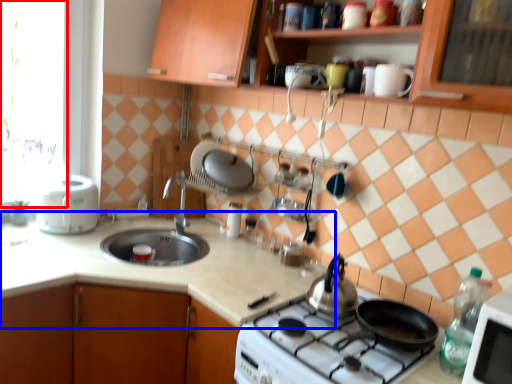
Question: Which object is further to the camera taking this photo, window screen (highlighted by a red box) or countertop (highlighted by a blue box)?

Choices:
 (A) window screen
 (B) countertop

Answer: (A)